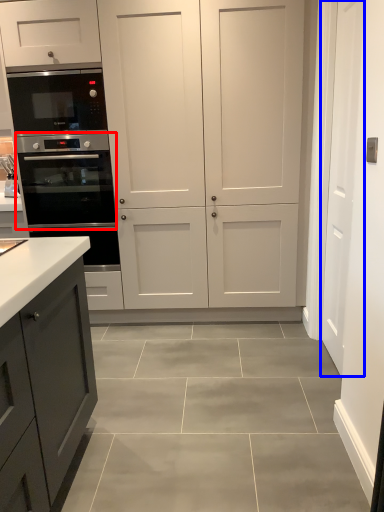
Question: Which point is closer to the camera, oven (highlighted by a red box) or door (highlighted by a blue box)?

Choices:
 (A) oven
 (B) door

Answer: (B)